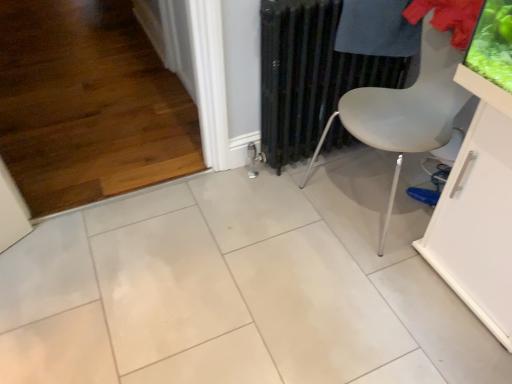
The width and height of the screenshot is (512, 384). Find the location of `vacant space in white matte chair at center-right (from a real-world perspective)`. vacant space in white matte chair at center-right (from a real-world perspective) is located at coordinates (378, 190).